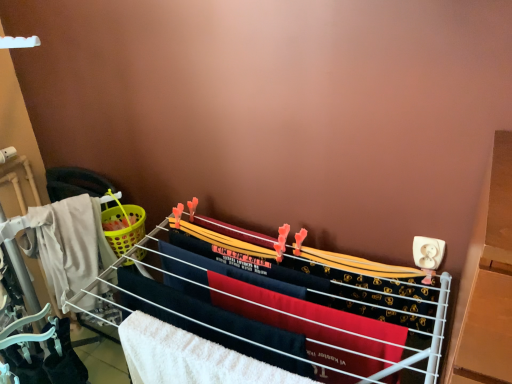
Question: Can you confirm if white fabric drying rack at center is shorter than white fluffy beach towel at center?

Choices:
 (A) no
 (B) yes

Answer: (A)

Question: From the image's perspective, does white fabric drying rack at center appear lower than white fluffy beach towel at center?

Choices:
 (A) no
 (B) yes

Answer: (B)

Question: From the image's perspective, is white fabric drying rack at center on top of white fluffy beach towel at center?

Choices:
 (A) no
 (B) yes

Answer: (A)

Question: From a real-world perspective, is white fabric drying rack at center located higher than white fluffy beach towel at center?

Choices:
 (A) no
 (B) yes

Answer: (A)

Question: Is white fabric drying rack at center to the left of white fluffy beach towel at center from the viewer's perspective?

Choices:
 (A) no
 (B) yes

Answer: (A)

Question: Can you confirm if white fabric drying rack at center is smaller than white fluffy beach towel at center?

Choices:
 (A) no
 (B) yes

Answer: (A)

Question: From a real-world perspective, is white fluffy beach towel at center positioned over white fabric drying rack at center based on gravity?

Choices:
 (A) yes
 (B) no

Answer: (A)

Question: From the image's perspective, is white fluffy beach towel at center on white fabric drying rack at center?

Choices:
 (A) no
 (B) yes

Answer: (B)

Question: Can you confirm if white fluffy beach towel at center is thinner than white fabric drying rack at center?

Choices:
 (A) yes
 (B) no

Answer: (A)

Question: Is white fluffy beach towel at center far from white fabric drying rack at center?

Choices:
 (A) yes
 (B) no

Answer: (B)

Question: Considering the relative positions of white fluffy beach towel at center and white fabric drying rack at center in the image provided, is white fluffy beach towel at center to the right of white fabric drying rack at center from the viewer's perspective?

Choices:
 (A) no
 (B) yes

Answer: (A)

Question: Is white fabric drying rack at center surrounded by white fluffy beach towel at center?

Choices:
 (A) no
 (B) yes

Answer: (A)

Question: Based on their positions, is white fluffy beach towel at center located to the left or right of white fabric drying rack at center?

Choices:
 (A) right
 (B) left

Answer: (B)